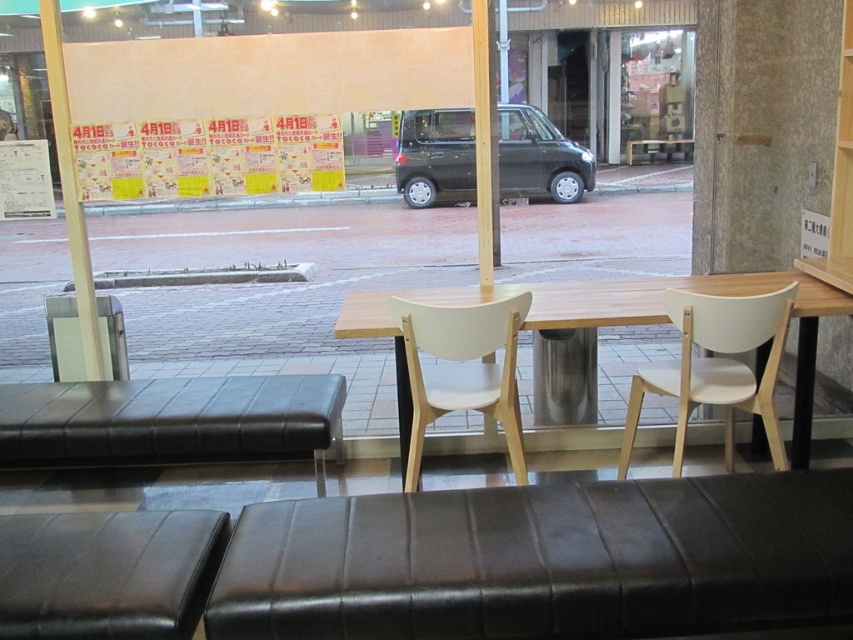
Between white matte chair at center and black leather hassock at center, which one appears on the left side from the viewer's perspective?

white matte chair at center is more to the left.

Between white matte chair at center and black leather hassock at center, which one has more height?

black leather hassock at center

Is point (479, 330) farther from camera compared to point (450, 129)?

No, (479, 330) is in front of (450, 129).

The image size is (853, 640). In order to click on white matte chair at center in this screenshot , I will do `click(462, 369)`.

Can you confirm if white matte chair at center is positioned below transparent glass window at center?

Yes.

The height and width of the screenshot is (640, 853). I want to click on white matte chair at center, so pos(462,369).

Is black leather bench at lower left shorter than light wood table at center?

Indeed, black leather bench at lower left has a lesser height compared to light wood table at center.

Is black leather bench at lower left closer to camera compared to light wood table at center?

No, it is behind light wood table at center.

Does point (44, 429) come closer to viewer compared to point (733, 280)?

That is True.

You are a GUI agent. You are given a task and a screenshot of the screen. Output one action in this format:
    pyautogui.click(x=<x>, y=<y>)
    Task: Click on the black leather bench at lower left
    
    Given the screenshot: What is the action you would take?
    pyautogui.click(x=171, y=420)